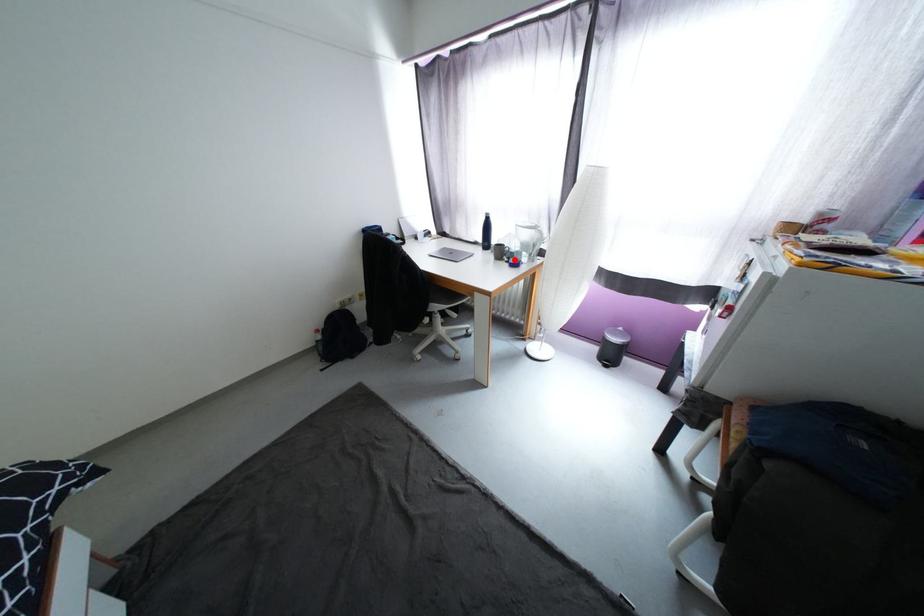
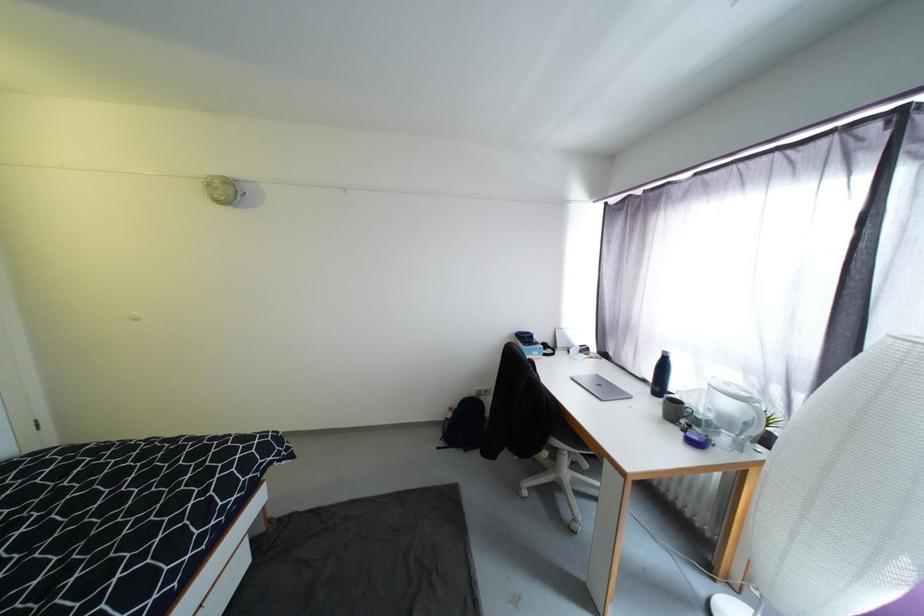
In the second image, find the point that corresponds to the highlighted location in the first image.

(696, 427)